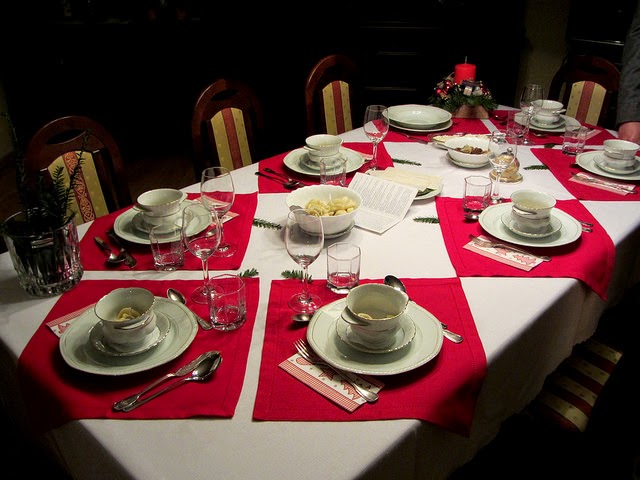
At what (x,y) coordinates should I click in order to perform the action: click on top of bowls. Please return your answer as a coordinate pair (x, y). Image resolution: width=640 pixels, height=480 pixels. Looking at the image, I should click on (118, 295), (150, 197), (321, 137), (532, 197), (550, 103), (614, 143), (374, 297).